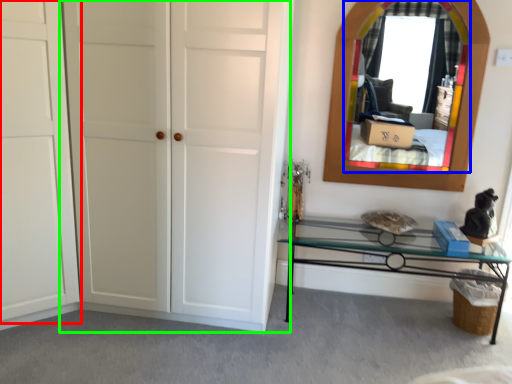
Question: Which object is positioned closest to door (highlighted by a red box)? Select from mirror (highlighted by a blue box) and door (highlighted by a green box).

Choices:
 (A) mirror
 (B) door

Answer: (B)